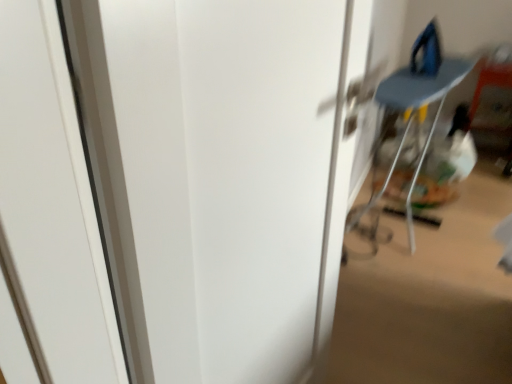
What is the approximate height of blue plastic ironing board at right?

blue plastic ironing board at right is 85.74 centimeters in height.

What are the coordinates of `blue plastic ironing board at right` in the screenshot? It's located at (414, 117).

Describe the element at coordinates (414, 117) in the screenshot. The width and height of the screenshot is (512, 384). I see `blue plastic ironing board at right` at that location.

I want to click on blue plastic ironing board at right, so click(414, 117).